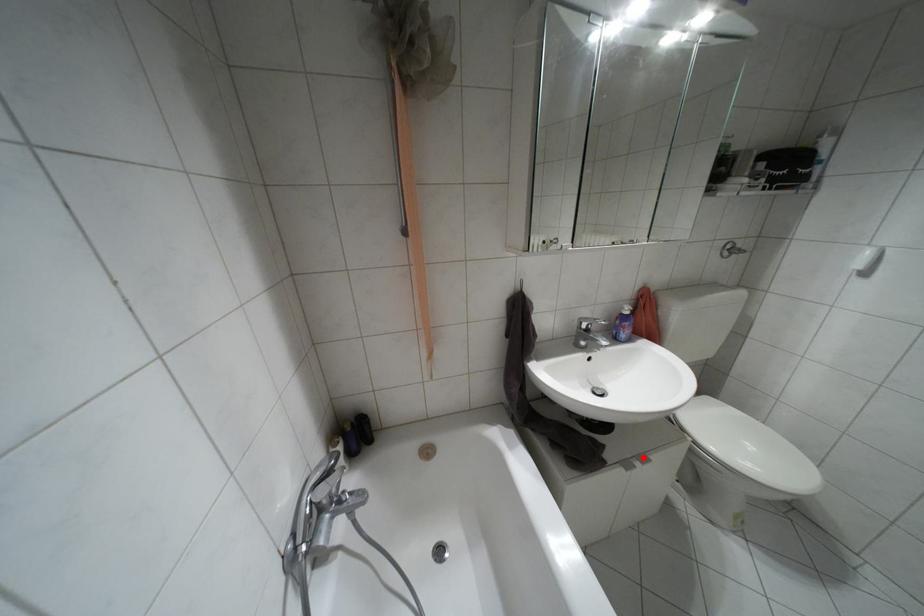
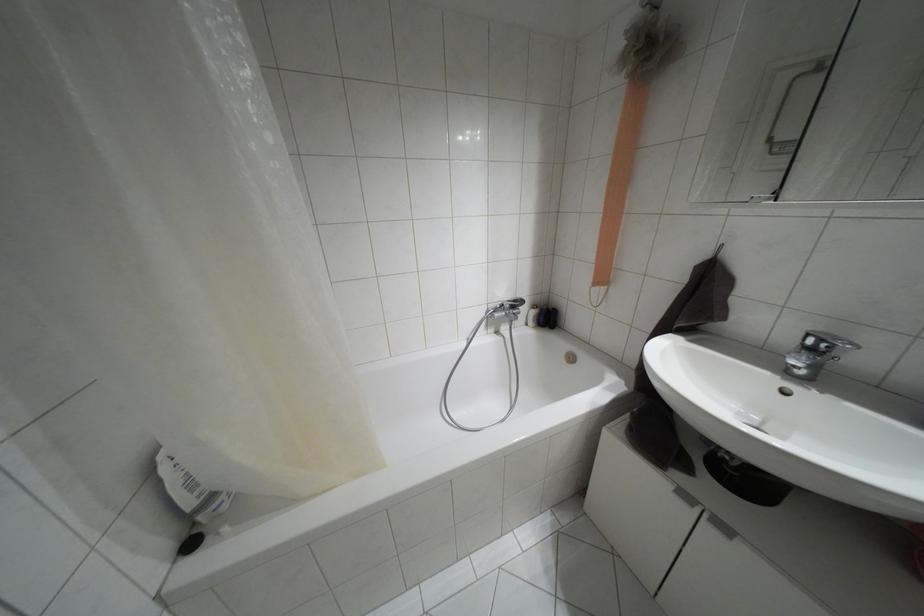
Question: I am providing you with two images of the same scene from different viewpoints. A red point is shown in image1. For the corresponding object point in image2, is it positioned nearer or farther from the camera?

Choices:
 (A) Nearer
 (B) Farther

Answer: (A)